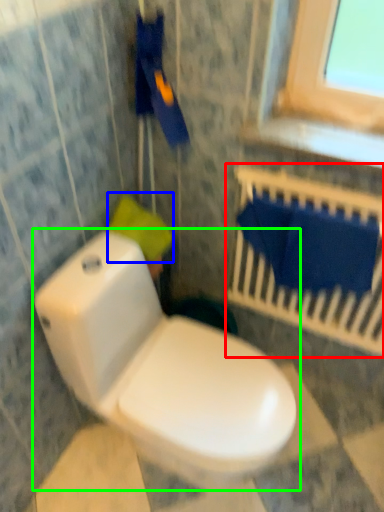
Question: Based on their relative distances, which object is nearer to balustrade (highlighted by a red box)? Choose from toilet paper (highlighted by a blue box) and toilet (highlighted by a green box).

Choices:
 (A) toilet paper
 (B) toilet

Answer: (A)